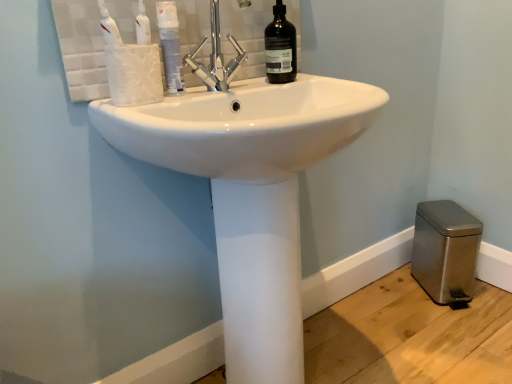
Question: Is white glossy mouthwash at upper center facing towards black glass bottle at upper center?

Choices:
 (A) no
 (B) yes

Answer: (A)

Question: Is white glossy mouthwash at upper center to the left of black glass bottle at upper center from the viewer's perspective?

Choices:
 (A) yes
 (B) no

Answer: (A)

Question: Considering the relative sizes of white glossy mouthwash at upper center and black glass bottle at upper center in the image provided, is white glossy mouthwash at upper center bigger than black glass bottle at upper center?

Choices:
 (A) yes
 (B) no

Answer: (B)

Question: Is there a large distance between white glossy mouthwash at upper center and black glass bottle at upper center?

Choices:
 (A) yes
 (B) no

Answer: (B)

Question: Is white glossy mouthwash at upper center behind black glass bottle at upper center?

Choices:
 (A) no
 (B) yes

Answer: (A)

Question: Considering the positions of point (227, 74) and point (230, 104), is point (227, 74) closer or farther from the camera than point (230, 104)?

Choices:
 (A) closer
 (B) farther

Answer: (B)

Question: Based on their positions, is chrome metallic faucet at upper center located to the left or right of white glossy sink at center?

Choices:
 (A) left
 (B) right

Answer: (A)

Question: From a real-world perspective, is chrome metallic faucet at upper center physically located above or below white glossy sink at center?

Choices:
 (A) above
 (B) below

Answer: (A)

Question: Based on their sizes in the image, would you say chrome metallic faucet at upper center is bigger or smaller than white glossy sink at center?

Choices:
 (A) small
 (B) big

Answer: (A)

Question: Considering the positions of white glossy sink at center and chrome metallic faucet at upper center in the image, is white glossy sink at center taller or shorter than chrome metallic faucet at upper center?

Choices:
 (A) short
 (B) tall

Answer: (B)

Question: From the image's perspective, is white glossy sink at center positioned above or below chrome metallic faucet at upper center?

Choices:
 (A) below
 (B) above

Answer: (A)

Question: Is white glossy sink at center in front of or behind chrome metallic faucet at upper center in the image?

Choices:
 (A) behind
 (B) front

Answer: (B)

Question: From a real-world perspective, is white glossy sink at center positioned above or below chrome metallic faucet at upper center?

Choices:
 (A) above
 (B) below

Answer: (B)

Question: Considering the positions of chrome metallic faucet at upper center and white glossy mouthwash at upper center in the image, is chrome metallic faucet at upper center wider or thinner than white glossy mouthwash at upper center?

Choices:
 (A) thin
 (B) wide

Answer: (B)

Question: In terms of size, does chrome metallic faucet at upper center appear bigger or smaller than white glossy mouthwash at upper center?

Choices:
 (A) small
 (B) big

Answer: (B)